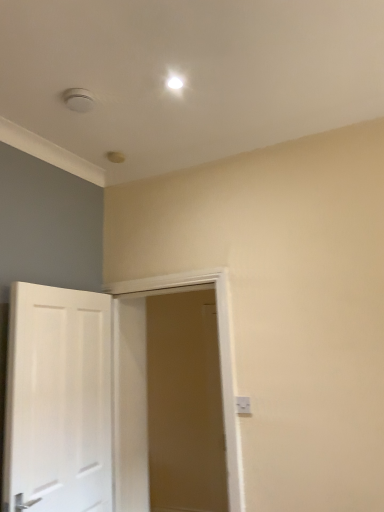
Question: Does white wooden door at center, which is the 2th door in left-to-right order, appear on the right side of white glossy door at left, the 2th door viewed from the right?

Choices:
 (A) no
 (B) yes

Answer: (B)

Question: From the image's perspective, is white wooden door at center, which is the 2th door in left-to-right order, located above white glossy door at left, arranged as the first door when viewed from the left?

Choices:
 (A) no
 (B) yes

Answer: (A)

Question: Does white wooden door at center, which is the first door in right-to-left order, have a greater width compared to white glossy door at left, the 2th door viewed from the right?

Choices:
 (A) no
 (B) yes

Answer: (A)

Question: Are white wooden door at center, which is the 2th door in left-to-right order, and white glossy door at left, arranged as the first door when viewed from the left, located far from each other?

Choices:
 (A) no
 (B) yes

Answer: (A)

Question: Can you confirm if white wooden door at center, which is the first door in right-to-left order, is thinner than white glossy door at left, arranged as the first door when viewed from the left?

Choices:
 (A) no
 (B) yes

Answer: (B)

Question: Considering the positions of point (38, 332) and point (246, 404), is point (38, 332) closer or farther from the camera than point (246, 404)?

Choices:
 (A) closer
 (B) farther

Answer: (A)

Question: Visually, is white glossy door at left, the 2th door viewed from the right, positioned to the left or to the right of white plastic electric outlet at lower right?

Choices:
 (A) right
 (B) left

Answer: (B)

Question: Is white glossy door at left, the 2th door viewed from the right, in front of or behind white plastic electric outlet at lower right in the image?

Choices:
 (A) behind
 (B) front

Answer: (B)

Question: From the image's perspective, is white glossy door at left, arranged as the first door when viewed from the left, above or below white plastic electric outlet at lower right?

Choices:
 (A) above
 (B) below

Answer: (B)

Question: Is white glossy door at left, arranged as the first door when viewed from the left, situated inside white wooden door at center, which is the 2th door in left-to-right order, or outside?

Choices:
 (A) outside
 (B) inside

Answer: (A)

Question: From the image's perspective, is white glossy door at left, arranged as the first door when viewed from the left, located above or below white wooden door at center, which is the first door in right-to-left order?

Choices:
 (A) below
 (B) above

Answer: (B)

Question: Is white glossy door at left, arranged as the first door when viewed from the left, to the left or to the right of white wooden door at center, which is the 2th door in left-to-right order, in the image?

Choices:
 (A) left
 (B) right

Answer: (A)

Question: In terms of width, does white glossy door at left, arranged as the first door when viewed from the left, look wider or thinner when compared to white wooden door at center, which is the 2th door in left-to-right order?

Choices:
 (A) wide
 (B) thin

Answer: (A)

Question: From the image's perspective, is white plastic electric outlet at lower right positioned above or below white glossy door at left, the 2th door viewed from the right?

Choices:
 (A) above
 (B) below

Answer: (A)

Question: Based on their positions, is white plastic electric outlet at lower right located to the left or right of white glossy door at left, the 2th door viewed from the right?

Choices:
 (A) left
 (B) right

Answer: (B)